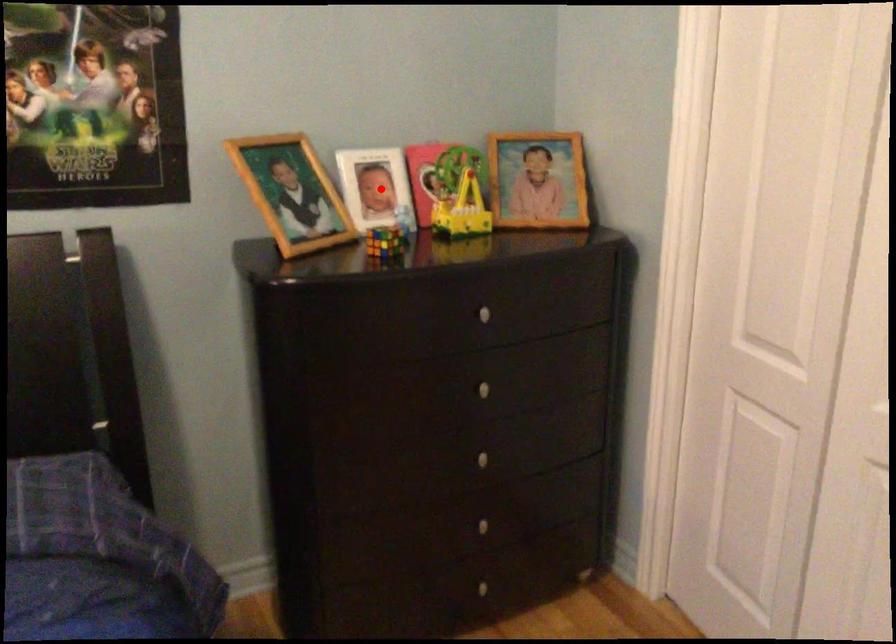
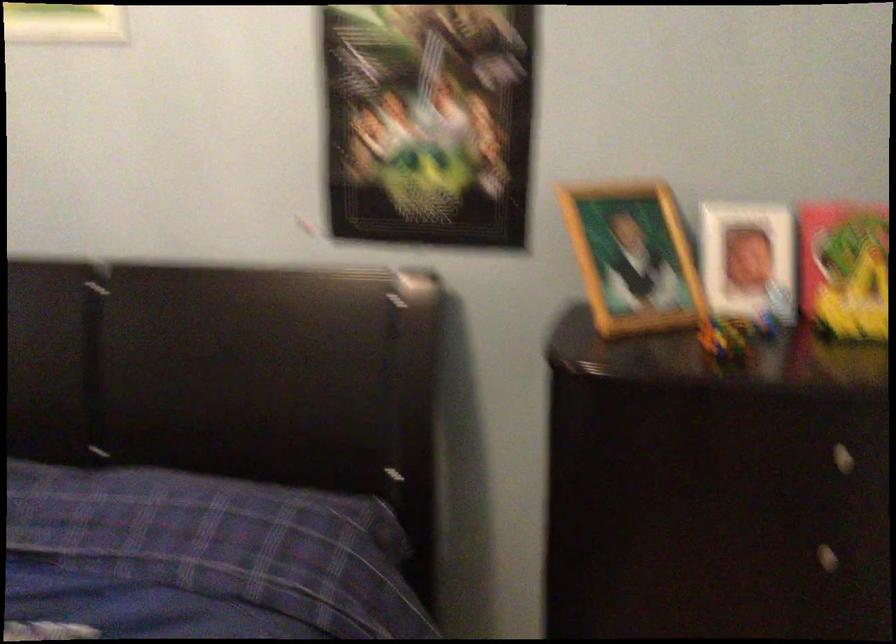
Find the pixel in the second image that matches the highlighted location in the first image.

(748, 261)